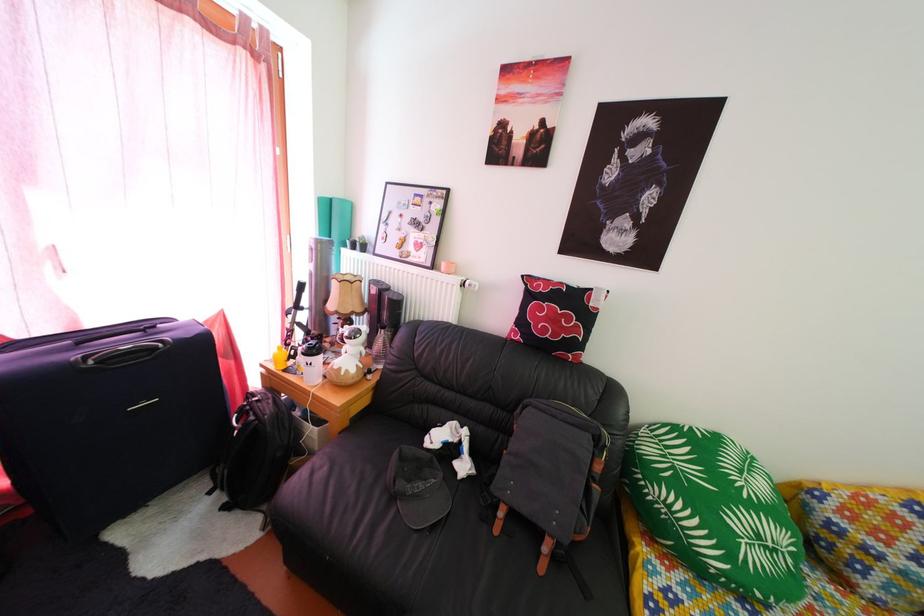
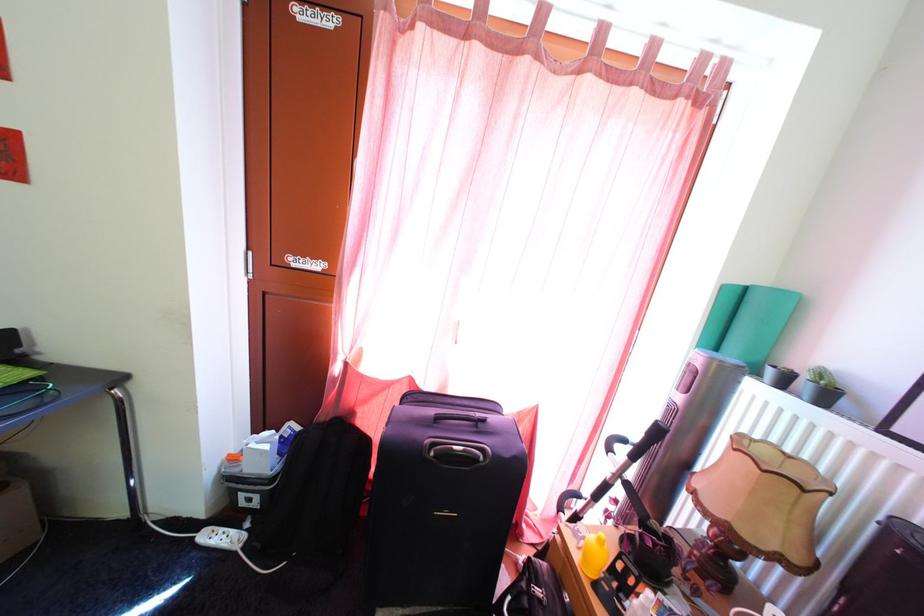
In the second image, find the point that corresponds to the point at 282,376 in the first image.

(585, 565)